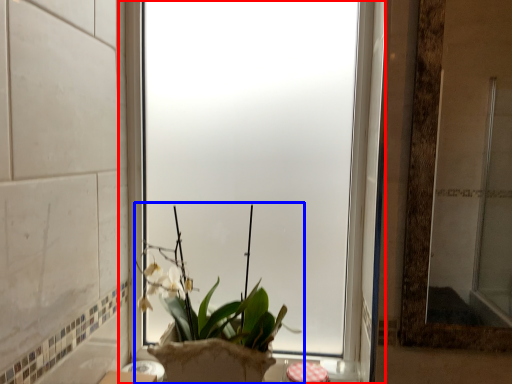
Question: Which object is closer to the camera taking this photo, window (highlighted by a red box) or houseplant (highlighted by a blue box)?

Choices:
 (A) window
 (B) houseplant

Answer: (B)